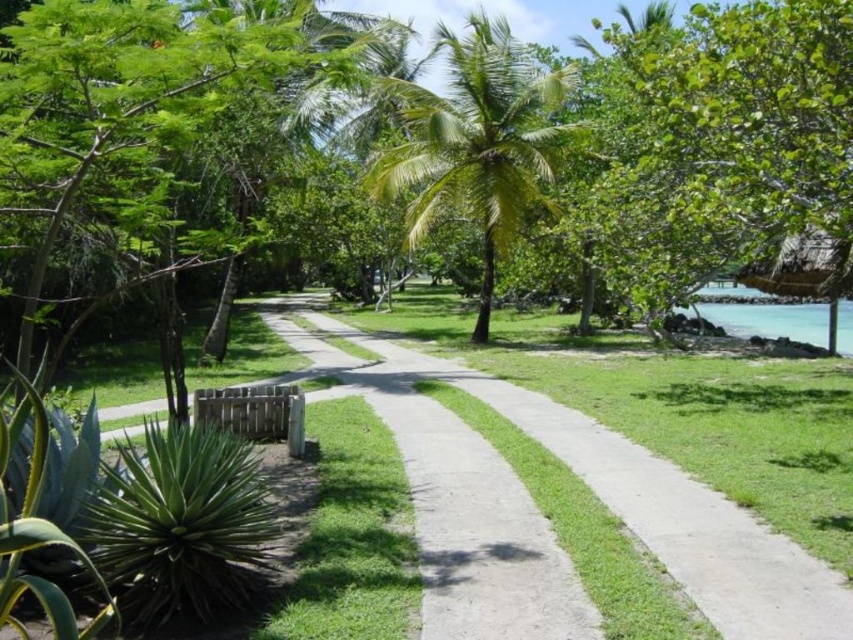
Question: Is green leafy palm tree at center below thatched roof hut at upper right?

Choices:
 (A) no
 (B) yes

Answer: (A)

Question: Does gray concrete path at center lie behind green leafy palm tree at center?

Choices:
 (A) no
 (B) yes

Answer: (A)

Question: Which object appears farthest from the camera in this image?

Choices:
 (A) green leafy palm tree at center
 (B) thatched roof hut at upper right

Answer: (A)

Question: Based on their relative distances, which object is farther from the thatched roof hut at upper right?

Choices:
 (A) green leafy palm tree at center
 (B) gray concrete path at center

Answer: (B)

Question: Among these objects, which one is nearest to the camera?

Choices:
 (A) green leafy palm tree at center
 (B) gray concrete path at center

Answer: (B)

Question: Is gray concrete path at center below green leafy palm tree at center?

Choices:
 (A) no
 (B) yes

Answer: (B)